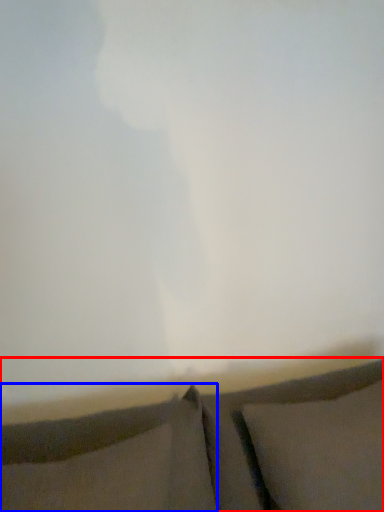
Question: Which object is further to the camera taking this photo, furniture (highlighted by a red box) or pillow (highlighted by a blue box)?

Choices:
 (A) furniture
 (B) pillow

Answer: (B)